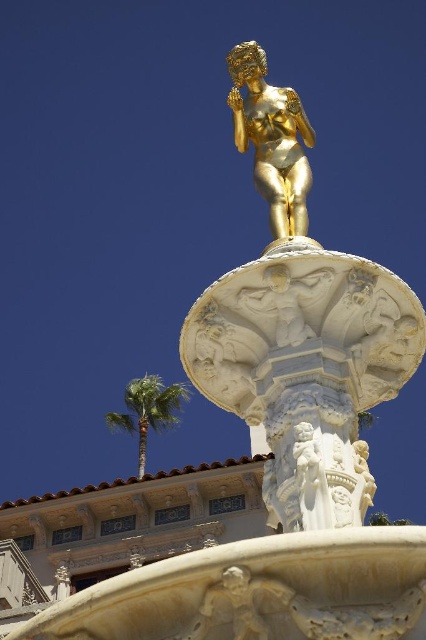
Question: Is gold metallic statue at center below green leafy palm tree at lower left?

Choices:
 (A) yes
 (B) no

Answer: (B)

Question: Which of the following is the farthest from the observer?

Choices:
 (A) gold metallic statue at center
 (B) gold polished statue at center
 (C) green leafy palm tree at lower left

Answer: (C)

Question: Can you confirm if gold metallic statue at center is positioned below green leafy palm tree at lower left?

Choices:
 (A) no
 (B) yes

Answer: (A)

Question: Which of the following is the closest to the observer?

Choices:
 (A) (170, 420)
 (B) (288, 205)

Answer: (B)

Question: Considering the relative positions of gold polished statue at center and gold metallic statue at center in the image provided, where is gold polished statue at center located with respect to gold metallic statue at center?

Choices:
 (A) right
 (B) left

Answer: (A)

Question: Which object is closer to the camera taking this photo?

Choices:
 (A) green leafy palm tree at lower left
 (B) gold polished statue at center
 (C) gold metallic statue at center

Answer: (B)